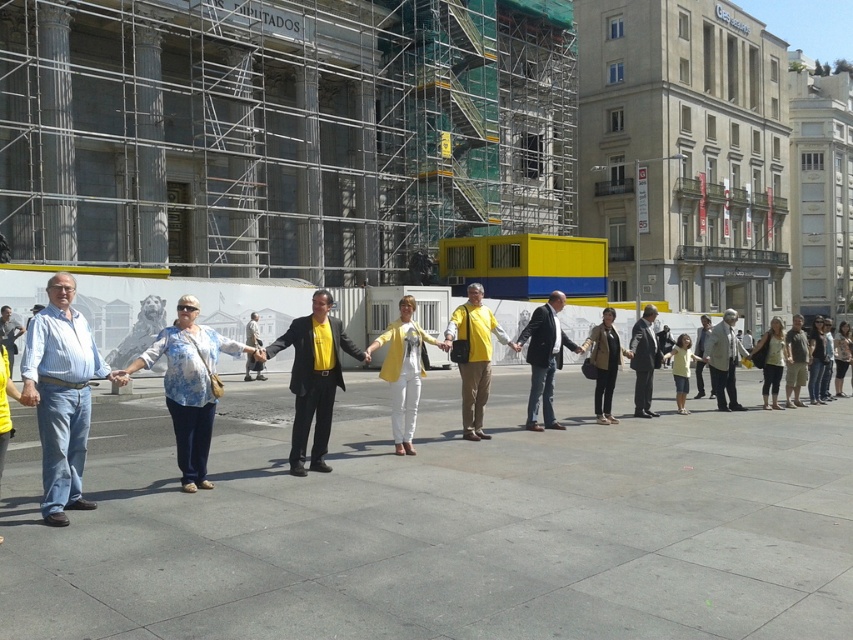
Does denim jeans at left have a larger size compared to light gray suit at center?

No, denim jeans at left is not bigger than light gray suit at center.

Between denim jeans at left and light gray suit at center, which one appears on the right side from the viewer's perspective?

light gray suit at center is more to the right.

Does point (48, 368) come closer to viewer compared to point (732, 348)?

Yes, point (48, 368) is in front of point (732, 348).

The height and width of the screenshot is (640, 853). What are the coordinates of `denim jeans at left` in the screenshot? It's located at (61, 394).

Measure the distance between point (469, 376) and camera.

A distance of 35.35 feet exists between point (469, 376) and camera.

How distant is matte yellow shirt at center from light gray suit at center?

matte yellow shirt at center is 7.17 meters away from light gray suit at center.

Does point (479, 344) come behind point (735, 312)?

No, it is in front of (735, 312).

Find the location of a particular element. matte yellow shirt at center is located at coordinates (474, 356).

Is point (296, 346) farther from camera compared to point (538, 355)?

No.

I want to click on matte black suit at center, so click(x=312, y=378).